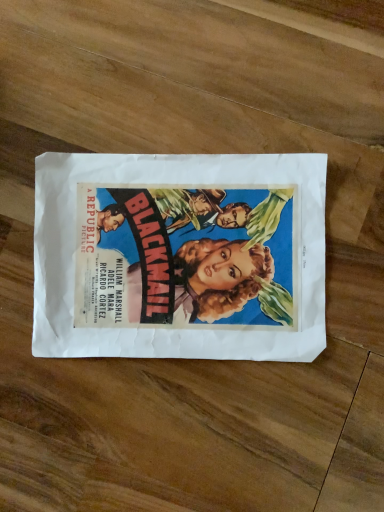
What do you see at coordinates (189, 187) in the screenshot? The image size is (384, 512). I see `matte paper poster at center` at bounding box center [189, 187].

The image size is (384, 512). Identify the location of matte paper poster at center. (189, 187).

Measure the distance between point [41,197] and camera.

Point [41,197] is 43.30 centimeters from camera.

I want to click on matte paper poster at center, so click(x=189, y=187).